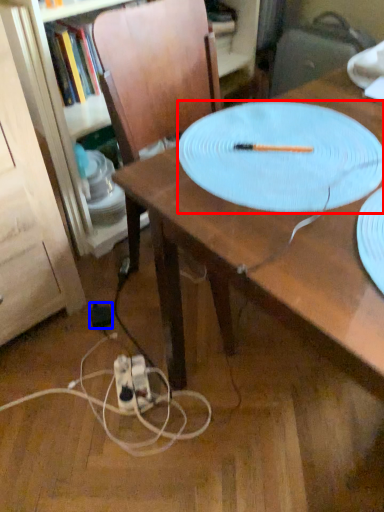
Question: Which of the following is the closest to the observer, platter (highlighted by a red box) or electric outlet (highlighted by a blue box)?

Choices:
 (A) platter
 (B) electric outlet

Answer: (A)